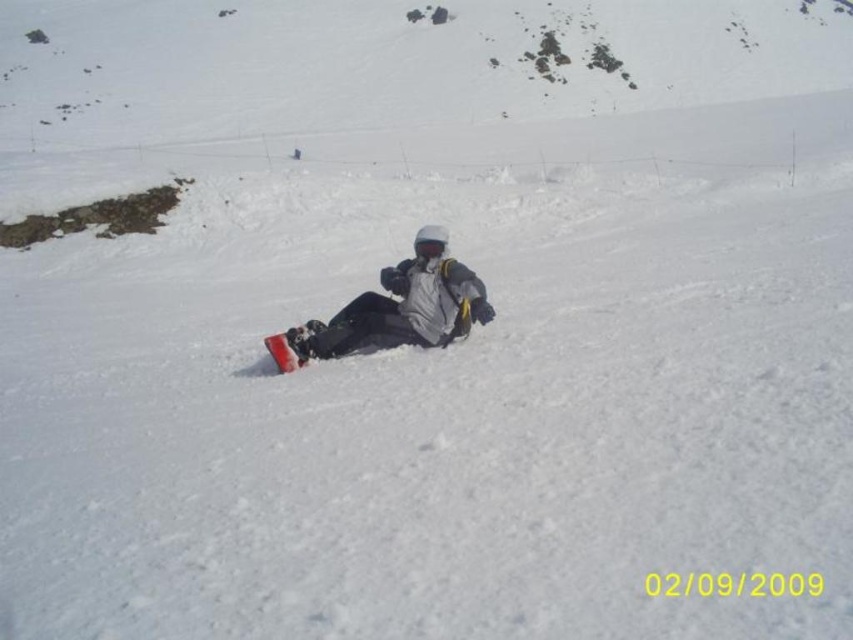
Question: Which of the following is the closest to the observer?

Choices:
 (A) (451, 296)
 (B) (289, 353)

Answer: (B)

Question: Does matte gray snowboard at center appear over matte red snowboard at center?

Choices:
 (A) yes
 (B) no

Answer: (A)

Question: Does matte gray snowboard at center lie in front of matte red snowboard at center?

Choices:
 (A) no
 (B) yes

Answer: (A)

Question: Is matte gray snowboard at center wider than matte red snowboard at center?

Choices:
 (A) yes
 (B) no

Answer: (A)